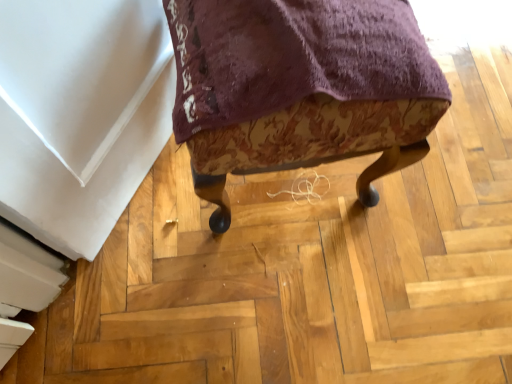
Locate an element on the screen. The height and width of the screenshot is (384, 512). empty space that is to the right of velvet floral ottoman at center is located at coordinates (453, 173).